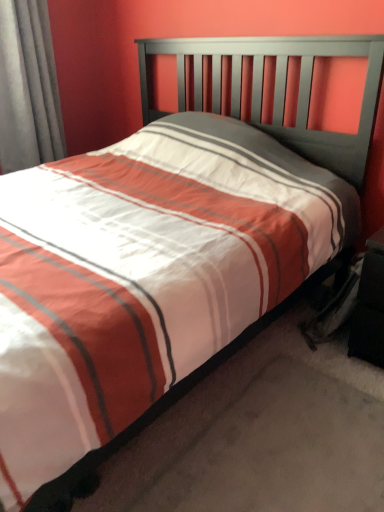
Where is `vacant space situated on the left part of black fabric nightstand at lower right`? The width and height of the screenshot is (384, 512). vacant space situated on the left part of black fabric nightstand at lower right is located at coordinates (299, 348).